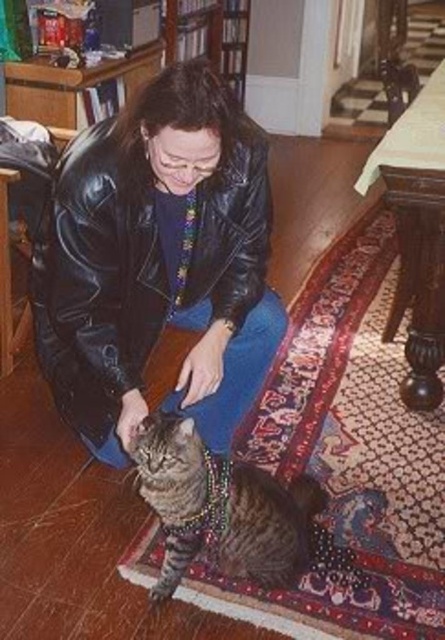
Is point (221, 216) closer to camera compared to point (199, 477)?

No, it is not.

Is black leather jacket at center to the right of tabby fur cat at center from the viewer's perspective?

No, black leather jacket at center is not to the right of tabby fur cat at center.

Is point (156, 305) closer to viewer compared to point (282, 515)?

No, (156, 305) is behind (282, 515).

The image size is (445, 640). What are the coordinates of `black leather jacket at center` in the screenshot? It's located at (98, 282).